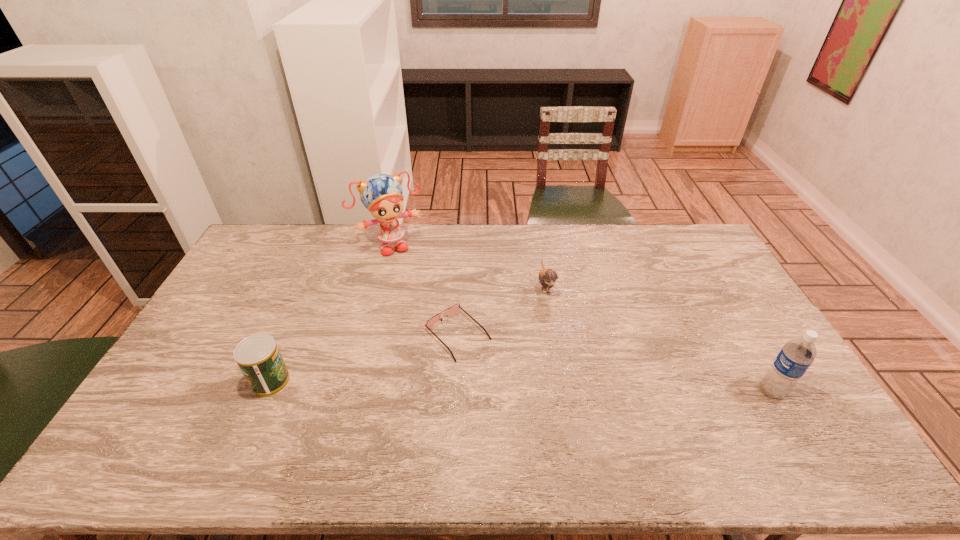
You are a GUI agent. You are given a task and a screenshot of the screen. Output one action in this format:
    pyautogui.click(x=<x>, y=<y>)
    Task: Click on the object that stands as the second closest to the kitten
    
    Given the screenshot: What is the action you would take?
    pyautogui.click(x=381, y=194)

I want to click on blank space that satisfies the following two spatial constraints: 1. on the back side of the doll; 2. on the right side of the can, so click(329, 245).